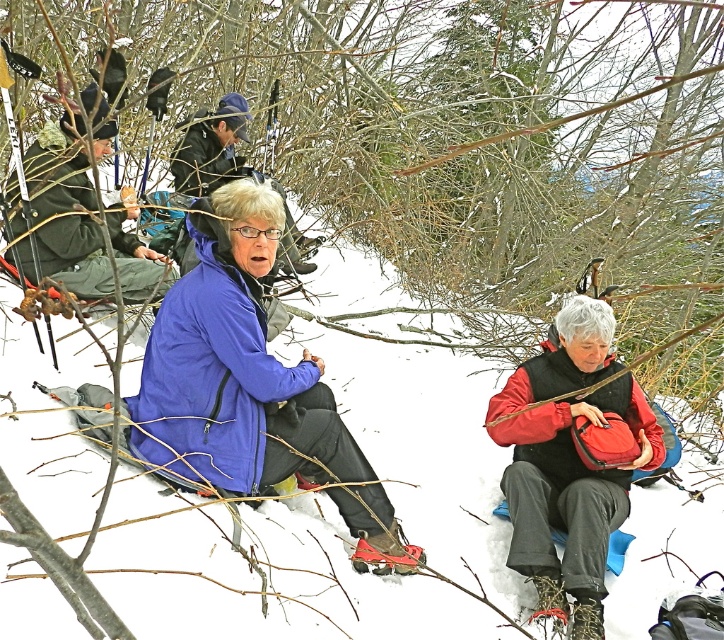
Question: Which object is positioned closest to the red rubber snowshoe at lower center?

Choices:
 (A) blue softshell jacket at center
 (B) dark blue jacket at upper center

Answer: (A)

Question: Which of these objects is positioned farthest from the blue softshell jacket at center?

Choices:
 (A) red rubber snowshoe at lower center
 (B) dark blue jacket at upper center

Answer: (B)

Question: Which object is farther from the camera taking this photo?

Choices:
 (A) red rubber snowshoe at lower center
 (B) dark blue jacket at upper center

Answer: (B)

Question: Is dark blue jacket at upper center bigger than red rubber snowshoe at lower center?

Choices:
 (A) yes
 (B) no

Answer: (A)

Question: From the image, what is the correct spatial relationship of blue softshell jacket at center in relation to red rubber snowshoe at lower center?

Choices:
 (A) below
 (B) above

Answer: (B)

Question: Can you confirm if blue softshell jacket at center is smaller than dark blue jacket at upper center?

Choices:
 (A) no
 (B) yes

Answer: (B)